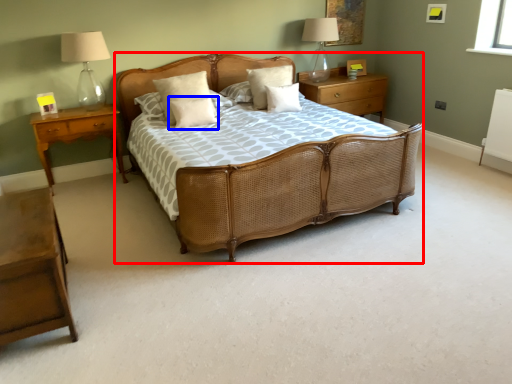
Question: Which object is further to the camera taking this photo, bed (highlighted by a red box) or pillow (highlighted by a blue box)?

Choices:
 (A) bed
 (B) pillow

Answer: (B)